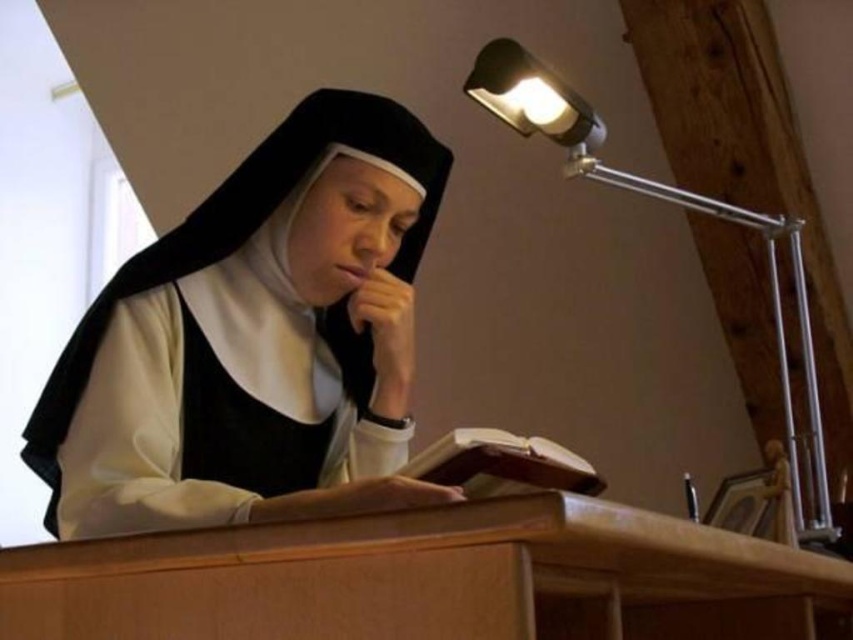
Is matte black habit at center taller than brown leather book at center?

Correct, matte black habit at center is much taller as brown leather book at center.

What do you see at coordinates (254, 340) in the screenshot? This screenshot has width=853, height=640. I see `matte black habit at center` at bounding box center [254, 340].

The height and width of the screenshot is (640, 853). In order to click on matte black habit at center in this screenshot , I will do `click(254, 340)`.

Which is below, light brown wooden table at center or metallic silver desk lamp at upper right?

light brown wooden table at center

Can you confirm if light brown wooden table at center is smaller than metallic silver desk lamp at upper right?

Indeed, light brown wooden table at center has a smaller size compared to metallic silver desk lamp at upper right.

Identify the location of light brown wooden table at center. (432, 579).

This screenshot has height=640, width=853. I want to click on light brown wooden table at center, so click(x=432, y=579).

Who is more forward, (387, 401) or (811, 499)?

Positioned in front is point (387, 401).

Who is taller, matte black habit at center or metallic silver desk lamp at upper right?

metallic silver desk lamp at upper right

This screenshot has width=853, height=640. Identify the location of matte black habit at center. (254, 340).